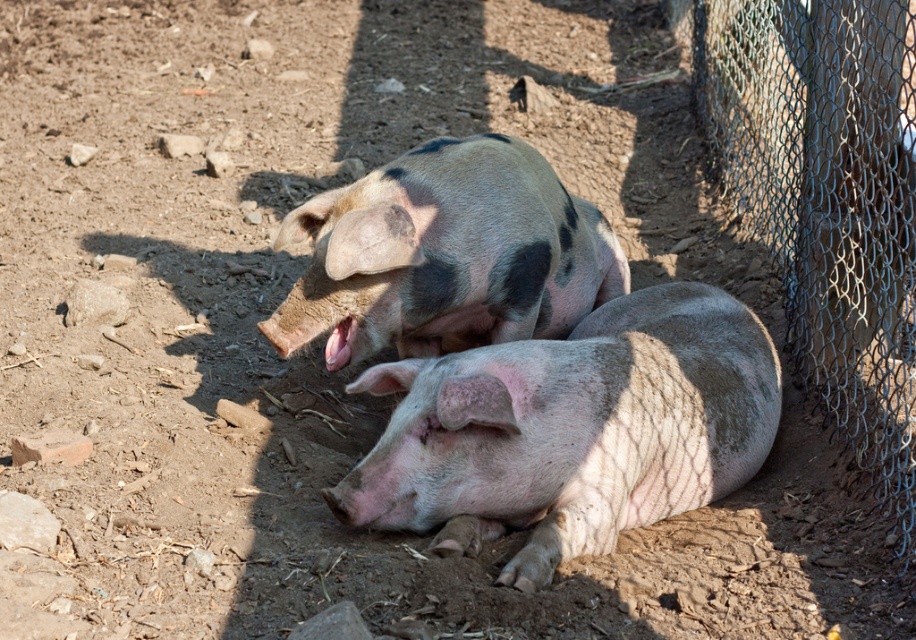
Who is positioned more to the right, pink textured skin at center or speckled pink pig at center?

From the viewer's perspective, pink textured skin at center appears more on the right side.

Does pink textured skin at center have a lesser width compared to speckled pink pig at center?

No, pink textured skin at center is not thinner than speckled pink pig at center.

What are the coordinates of `pink textured skin at center` in the screenshot? It's located at click(x=571, y=429).

Who is more forward, (815, 33) or (460, 196)?

Point (460, 196)

Between wire mesh fence at right and speckled pink pig at center, which one has less height?

speckled pink pig at center is shorter.

Who is more forward, (745, 196) or (405, 349)?

Point (405, 349)

Locate an element on the screen. The height and width of the screenshot is (640, 916). wire mesh fence at right is located at coordinates (826, 196).

Based on the photo, is pink textured skin at center taller than wire mesh fence at right?

Incorrect, pink textured skin at center's height is not larger of wire mesh fence at right's.

At what (x,y) coordinates should I click in order to perform the action: click on pink textured skin at center. Please return your answer as a coordinate pair (x, y). The height and width of the screenshot is (640, 916). Looking at the image, I should click on (571, 429).